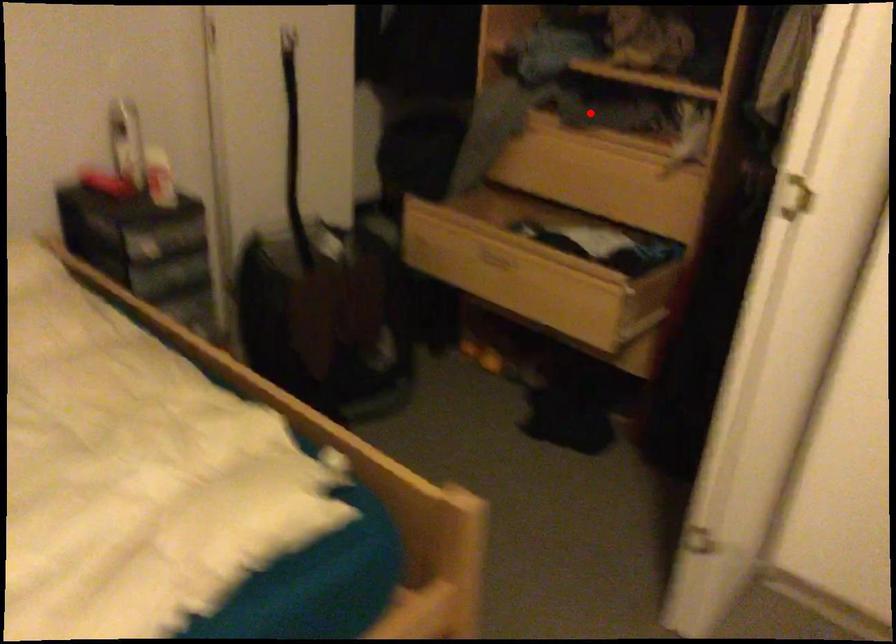
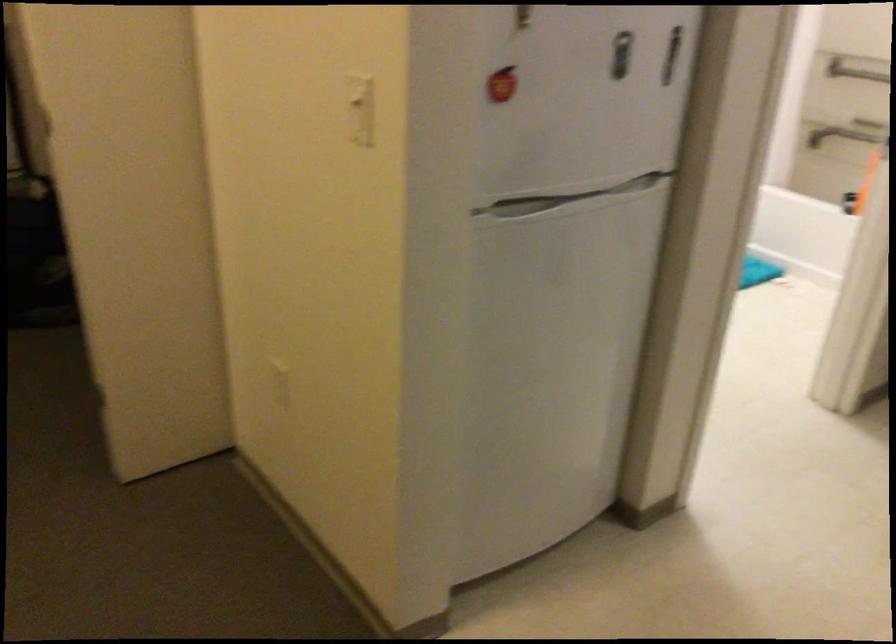
Question: I am providing you with two images of the same scene from different viewpoints. A red point is marked on the first image. Can you still see the location of the red point in image 2?

Choices:
 (A) Yes
 (B) No

Answer: (B)